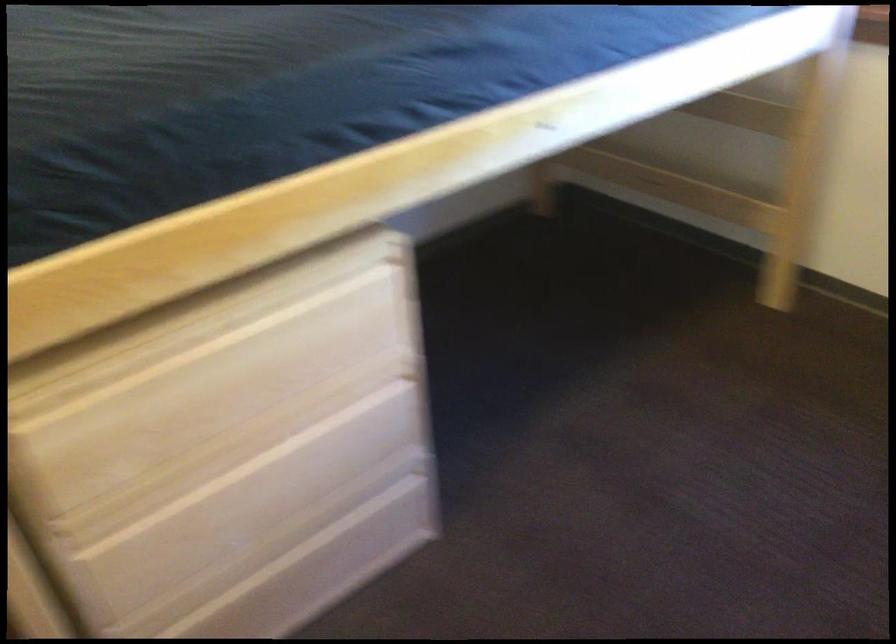
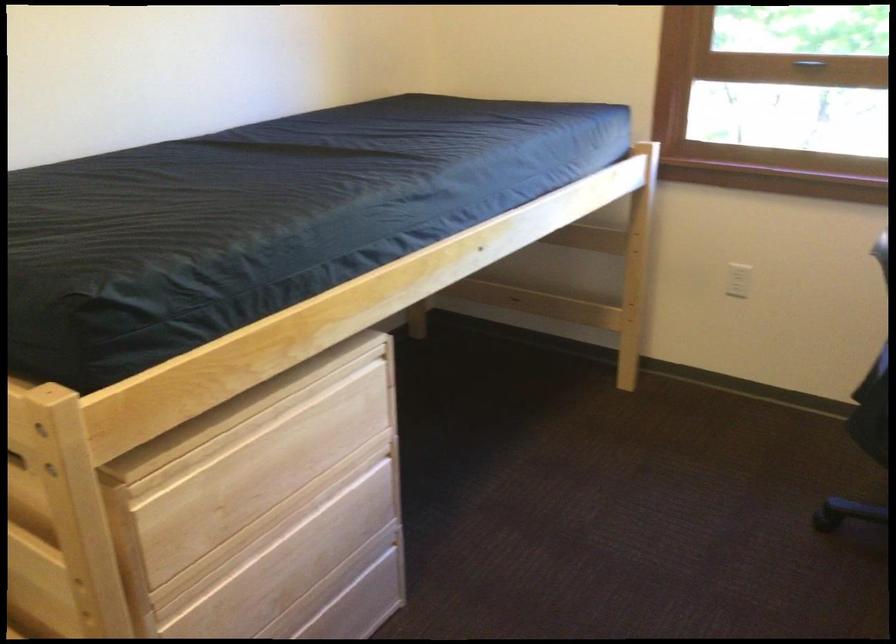
Where in the second image is the point corresponding to (x=358, y=536) from the first image?

(354, 611)